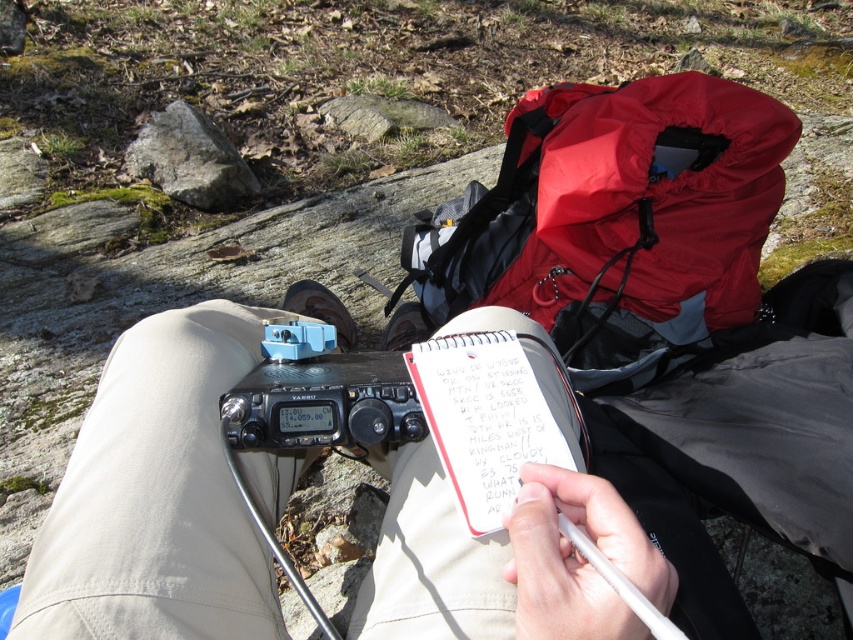
You are a hiker who needs to access the black plastic radio at center to check the weather forecast. However, the waterproof nylon backpack at upper right is blocking your view. Can you move the backpack to access the radio?

The black plastic radio at center is behind the waterproof nylon backpack at upper right, so you can move the backpack to access the radio.

You are a hiker who needs to retrieve your white paper notepad at center. There is a waterproof nylon backpack at upper right in the way. Can you reach the notepad without moving the backpack?

The waterproof nylon backpack at upper right is located above the white paper notepad at center, so you can reach the notepad without moving the backpack since it is positioned below the backpack.

You are planning to pack your camping gear and need to place the black plastic radio at center into the waterproof nylon backpack at upper right. Based on their sizes, will the radio fit inside the backpack?

The waterproof nylon backpack at upper right has a greater height compared to the black plastic radio at center, so the radio should fit inside the backpack since the backpack is taller than the radio.